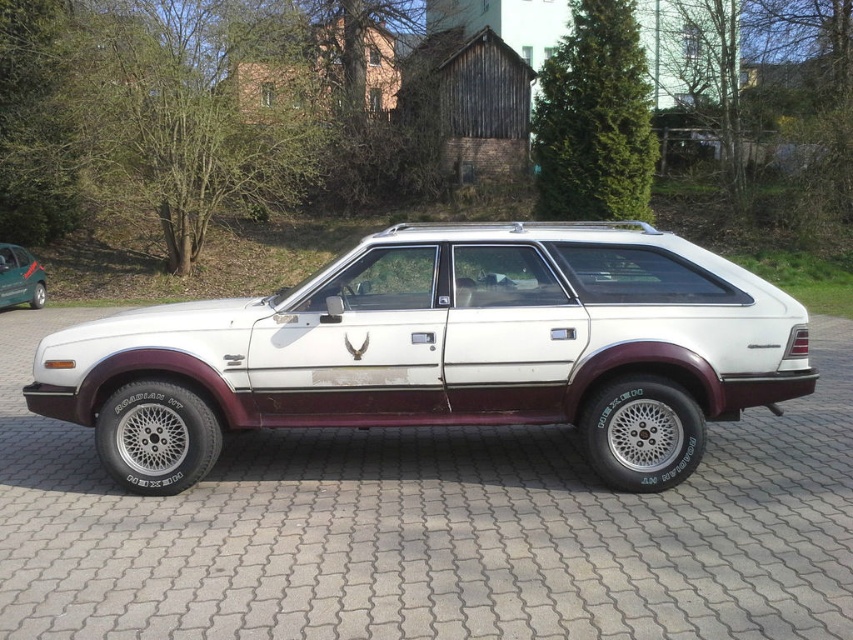
Can you confirm if white paved driveway at center is positioned to the left of white matte station wagon at center?

Correct, you'll find white paved driveway at center to the left of white matte station wagon at center.

Which of these two, white paved driveway at center or white matte station wagon at center, stands shorter?

white matte station wagon at center is shorter.

Is point (277, 589) more distant than point (386, 269)?

No, (277, 589) is in front of (386, 269).

You are a GUI agent. You are given a task and a screenshot of the screen. Output one action in this format:
    pyautogui.click(x=<x>, y=<y>)
    Task: Click on the white paved driveway at center
    This screenshot has height=640, width=853.
    Given the screenshot: What is the action you would take?
    pyautogui.click(x=430, y=529)

Does white paved driveway at center have a smaller size compared to green matte hatchback at left?

No.

Can you confirm if white paved driveway at center is thinner than green matte hatchback at left?

In fact, white paved driveway at center might be wider than green matte hatchback at left.

Find the location of a particular element. The image size is (853, 640). white paved driveway at center is located at coordinates (430, 529).

Between point (502, 300) and point (38, 262), which one is positioned behind?

The point (38, 262) is more distant.

Looking at this image, measure the distance between white matte station wagon at center and camera.

white matte station wagon at center and camera are 4.80 meters apart.

I want to click on white matte station wagon at center, so click(444, 349).